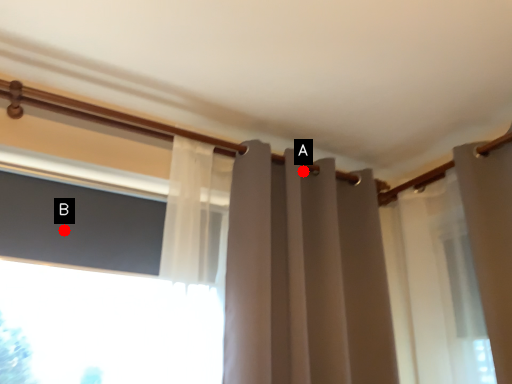
Question: Two points are circled on the image, labeled by A and B beside each circle. Which point is farther to the camera?

Choices:
 (A) A is further
 (B) B is further

Answer: (A)